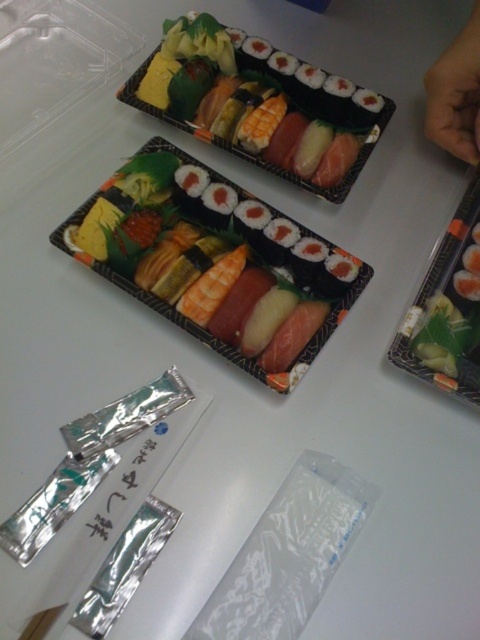
Can you confirm if shiny plastic sushi at upper center is thinner than satin black sushi at right?

No.

Can you confirm if shiny plastic sushi at upper center is shorter than satin black sushi at right?

Yes, shiny plastic sushi at upper center is shorter than satin black sushi at right.

Is point (287, 65) behind point (477, 308)?

Yes.

Locate an element on the screen. Image resolution: width=480 pixels, height=640 pixels. shiny plastic sushi at upper center is located at coordinates (260, 104).

Which of these two, shiny black sushi at center or shiny plastic sushi at upper center, stands shorter?

shiny plastic sushi at upper center

Based on the photo, is shiny black sushi at center below shiny plastic sushi at upper center?

Correct, shiny black sushi at center is located below shiny plastic sushi at upper center.

Identify the location of shiny black sushi at center. The width and height of the screenshot is (480, 640). click(x=216, y=260).

Locate an element on the screen. shiny black sushi at center is located at coordinates (216, 260).

Who is taller, shiny black sushi at center or skinny hand at upper right?

shiny black sushi at center

Does point (269, 296) lie in front of point (458, 145)?

Yes, it is in front of point (458, 145).

This screenshot has height=640, width=480. I want to click on shiny black sushi at center, so click(x=216, y=260).

Identify the location of shiny black sushi at center. (216, 260).